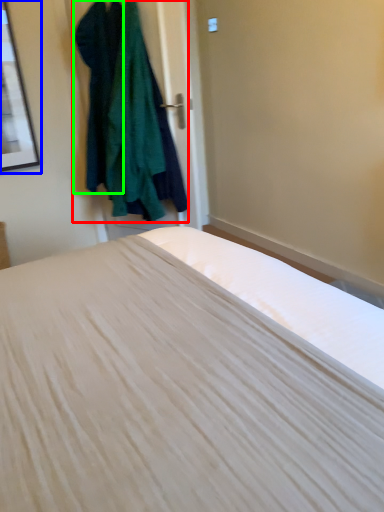
Question: Which object is the closest to the clothing (highlighted by a red box)? Choose among these: picture frame (highlighted by a blue box) or clothing (highlighted by a green box).

Choices:
 (A) picture frame
 (B) clothing

Answer: (B)